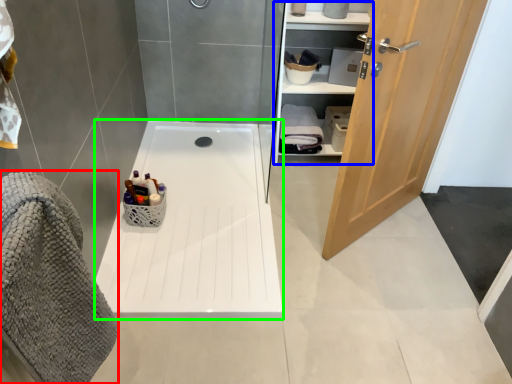
Question: Based on their relative distances, which object is nearer to bath towel (highlighted by a red box)? Choose from closet (highlighted by a blue box) and bath (highlighted by a green box).

Choices:
 (A) closet
 (B) bath

Answer: (B)